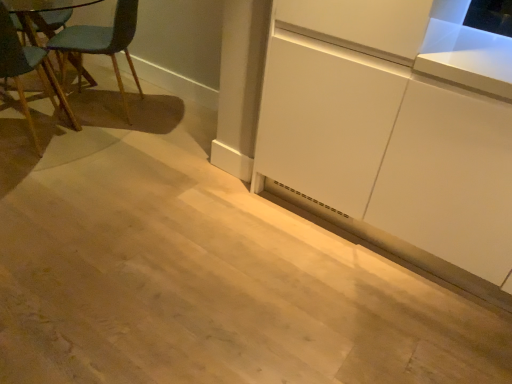
Question: Can you confirm if teal fabric chair at left is shorter than white matte cabinet at lower right?

Choices:
 (A) yes
 (B) no

Answer: (A)

Question: Is there a large distance between teal fabric chair at left and white matte cabinet at lower right?

Choices:
 (A) no
 (B) yes

Answer: (B)

Question: Is teal fabric chair at left taller than white matte cabinet at lower right?

Choices:
 (A) no
 (B) yes

Answer: (A)

Question: Considering the relative sizes of teal fabric chair at left and white matte cabinet at lower right in the image provided, is teal fabric chair at left smaller than white matte cabinet at lower right?

Choices:
 (A) yes
 (B) no

Answer: (B)

Question: Does teal fabric chair at left turn towards white matte cabinet at lower right?

Choices:
 (A) no
 (B) yes

Answer: (A)

Question: Does teal fabric chair at left touch white matte cabinet at lower right?

Choices:
 (A) yes
 (B) no

Answer: (B)

Question: Can you confirm if white matte cabinet at lower right is bigger than teal fabric chair at left?

Choices:
 (A) no
 (B) yes

Answer: (A)

Question: From the image's perspective, would you say white matte cabinet at lower right is positioned over teal fabric chair at left?

Choices:
 (A) no
 (B) yes

Answer: (A)

Question: Is white matte cabinet at lower right wider than teal fabric chair at left?

Choices:
 (A) no
 (B) yes

Answer: (A)

Question: Can you confirm if white matte cabinet at lower right is positioned to the left of teal fabric chair at left?

Choices:
 (A) no
 (B) yes

Answer: (A)

Question: From the image's perspective, is white matte cabinet at lower right under teal fabric chair at left?

Choices:
 (A) yes
 (B) no

Answer: (A)

Question: Can you confirm if white matte cabinet at lower right is thinner than teal fabric chair at left?

Choices:
 (A) no
 (B) yes

Answer: (B)

Question: Is point (352, 142) closer or farther from the camera than point (72, 122)?

Choices:
 (A) farther
 (B) closer

Answer: (B)